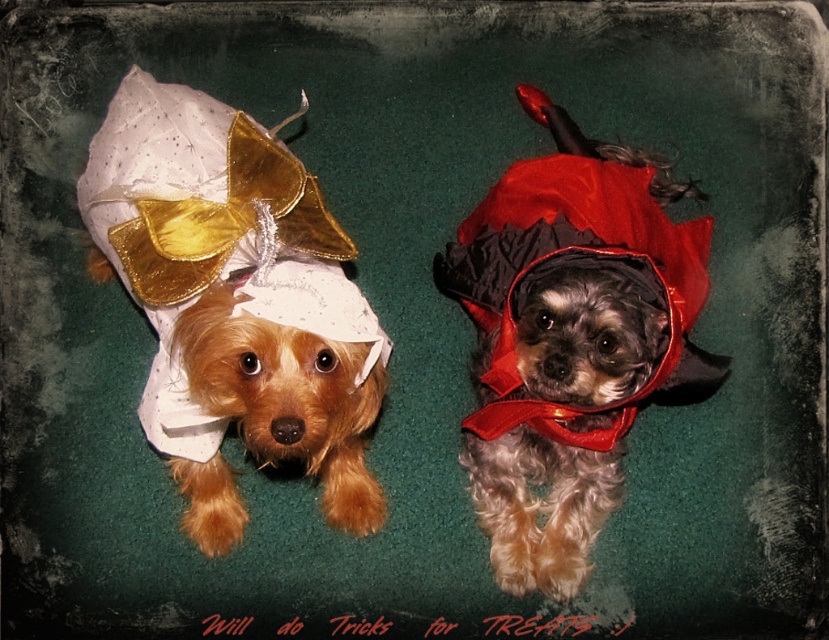
Does shiny white dress at upper left have a greater height compared to velvet red cape at center?

No.

Who is positioned more to the left, shiny white dress at upper left or velvet red cape at center?

shiny white dress at upper left

Who is more distant from viewer, (158, 394) or (602, 349)?

The point (158, 394) is more distant.

Find the location of `shiny white dress at upper left`. shiny white dress at upper left is located at coordinates point(234,301).